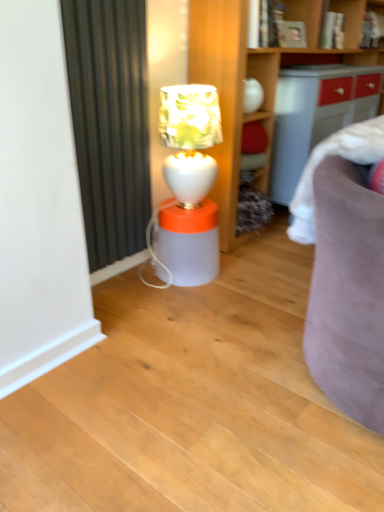
Question: In terms of height, does white glossy table lamp at center look taller or shorter compared to translucent plastic lamp at center?

Choices:
 (A) short
 (B) tall

Answer: (B)

Question: From the image's perspective, relative to translucent plastic lamp at center, is white glossy table lamp at center above or below?

Choices:
 (A) above
 (B) below

Answer: (A)

Question: In the image, is white glossy table lamp at center on the left side or the right side of translucent plastic lamp at center?

Choices:
 (A) left
 (B) right

Answer: (B)

Question: Considering the positions of point (188, 251) and point (192, 117), is point (188, 251) closer or farther from the camera than point (192, 117)?

Choices:
 (A) closer
 (B) farther

Answer: (B)

Question: Visually, is translucent plastic lamp at center positioned to the left or to the right of white glossy table lamp at center?

Choices:
 (A) left
 (B) right

Answer: (A)

Question: Is translucent plastic lamp at center spatially inside white glossy table lamp at center, or outside of it?

Choices:
 (A) inside
 (B) outside

Answer: (B)

Question: In terms of height, does translucent plastic lamp at center look taller or shorter compared to white glossy table lamp at center?

Choices:
 (A) short
 (B) tall

Answer: (A)